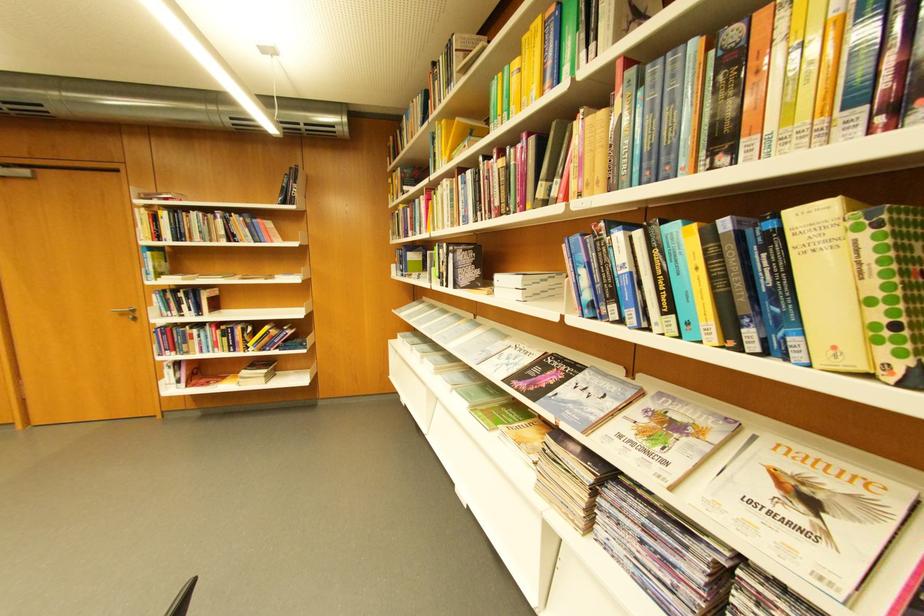
Where would you open the Nature magazine? Please return your answer as a coordinate pair (x, y).

(810, 519)